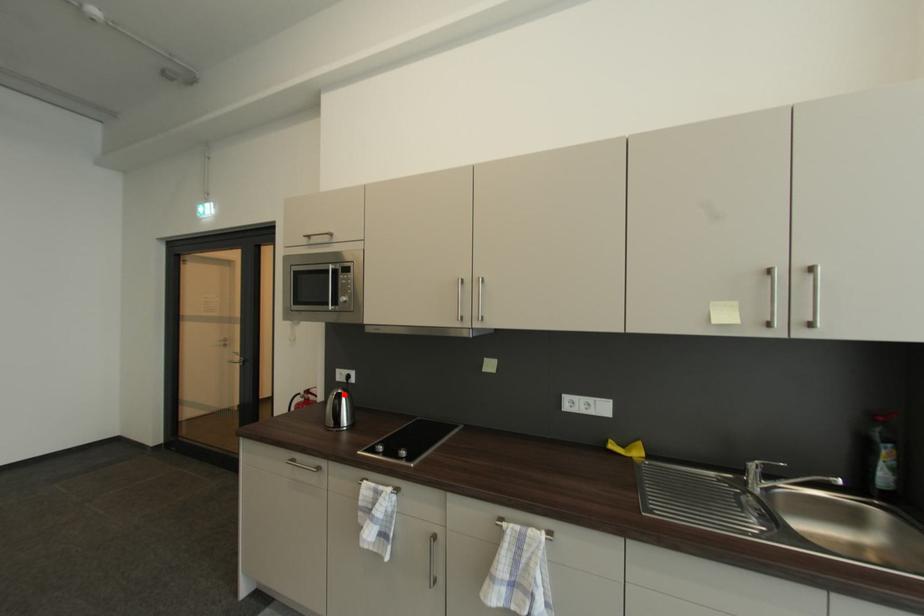
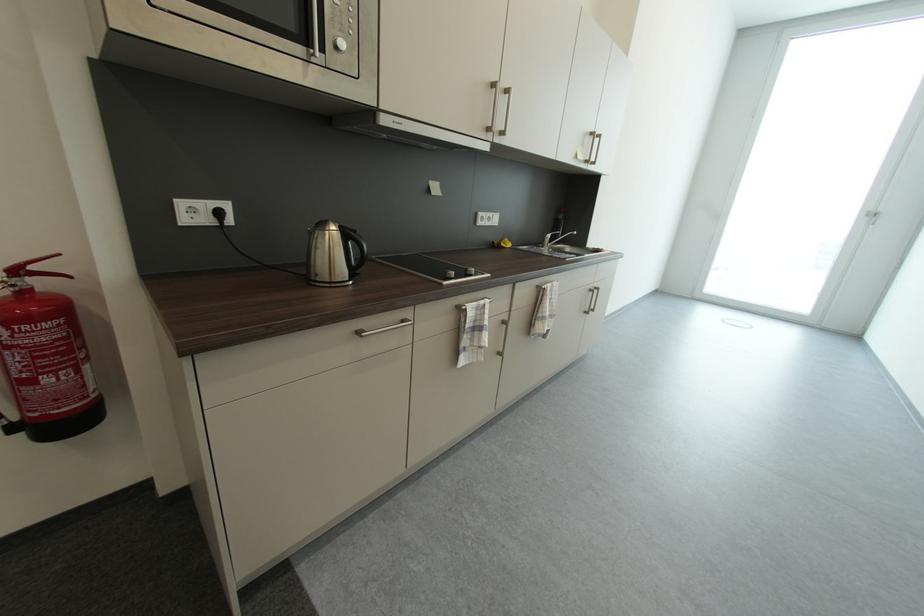
The point at the highlighted location is marked in the first image. Where is the corresponding point in the second image?

(346, 228)